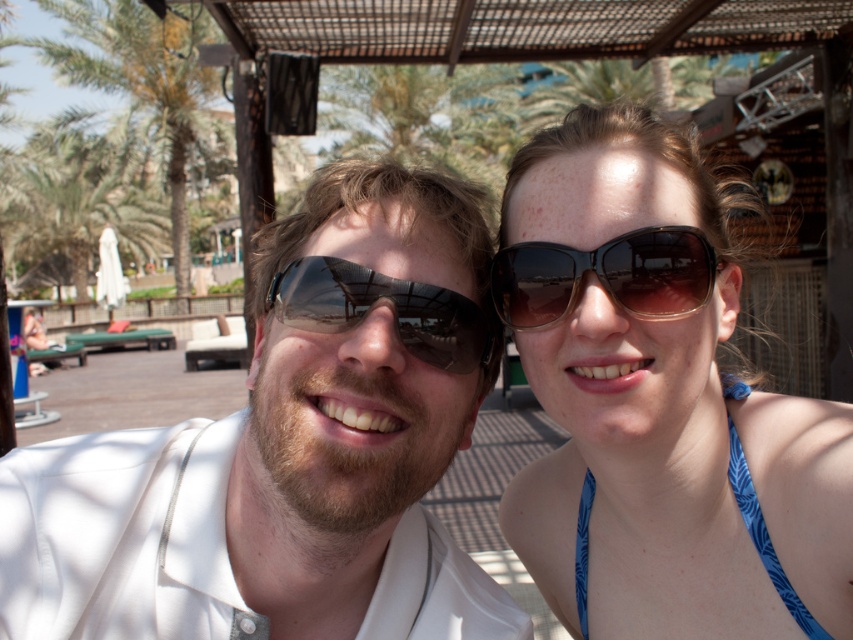
Question: Can you confirm if white matte sunglasses at center is wider than blue printed fabric bikini top at upper right?

Choices:
 (A) yes
 (B) no

Answer: (A)

Question: Which point is closer to the camera?

Choices:
 (A) (175, 86)
 (B) (126, 154)

Answer: (A)

Question: Is matte black sunglasses at upper right to the right of green leafy palm tree at left from the viewer's perspective?

Choices:
 (A) no
 (B) yes

Answer: (B)

Question: Which of the following is the farthest from the observer?

Choices:
 (A) (584, 456)
 (B) (166, 545)
 (C) (396, 314)

Answer: (A)

Question: Based on their relative distances, which object is nearer to the green leafy palm tree at upper left?

Choices:
 (A) black shiny sunglasses at upper center
 (B) blue printed fabric bikini top at upper right
 (C) green leafy palm tree at left

Answer: (C)

Question: Is matte black sunglasses at upper right bigger than black shiny sunglasses at upper center?

Choices:
 (A) no
 (B) yes

Answer: (B)